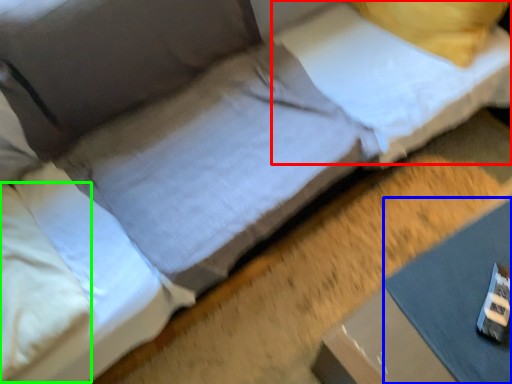
Question: Considering the real-world distances, which object is closest to pillow (highlighted by a red box)? sheet (highlighted by a blue box) or pillow (highlighted by a green box).

Choices:
 (A) sheet
 (B) pillow

Answer: (A)